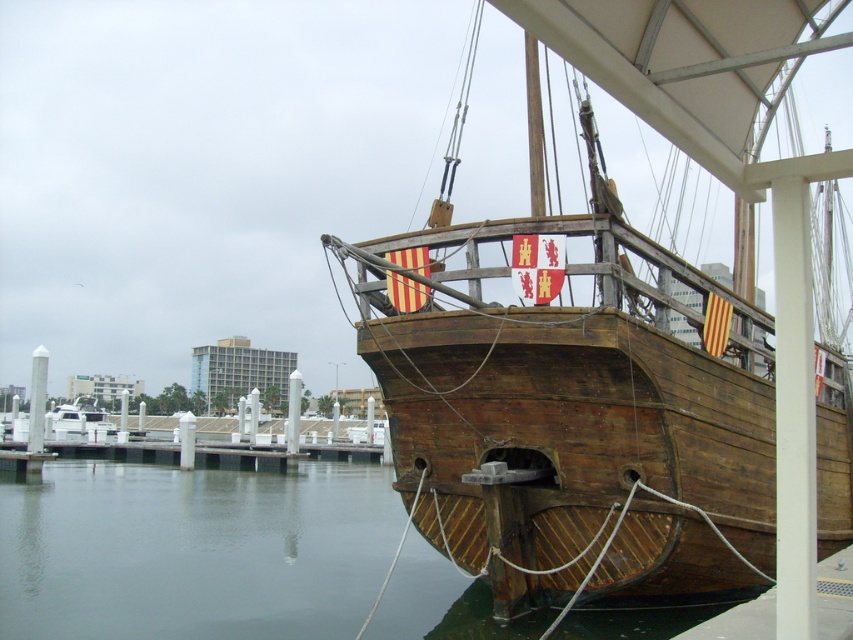
Who is positioned more to the right, wooden ship at center or wooden water at lower left?

Positioned to the right is wooden ship at center.

Does point (466, 296) come farther from viewer compared to point (83, 621)?

No, (466, 296) is closer to viewer.

Does point (456, 376) lie in front of point (431, 625)?

Yes, point (456, 376) is closer to viewer.

Identify the location of wooden ship at center. coord(628,349).